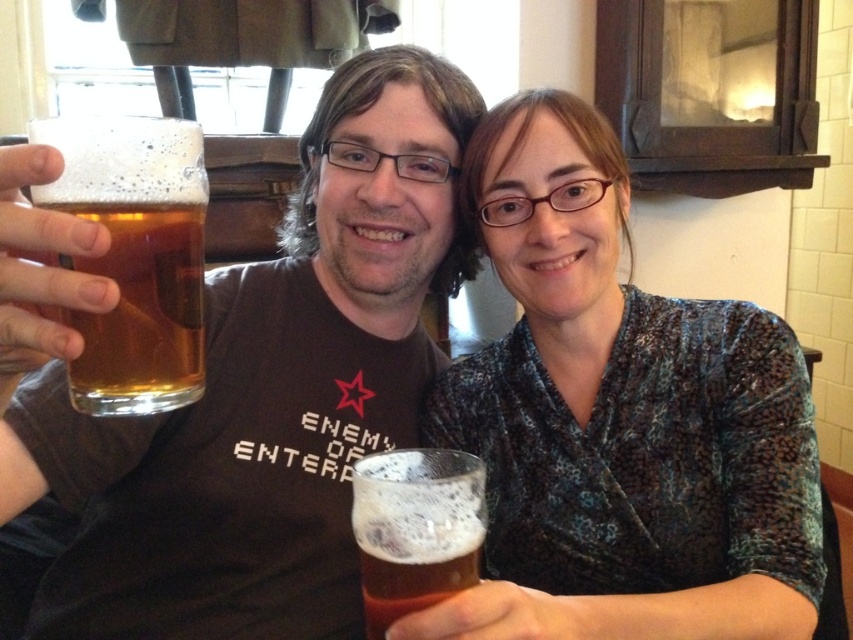
Question: Is translucent glass mug at upper left thinner than golden glass at left?

Choices:
 (A) no
 (B) yes

Answer: (A)

Question: Which point appears farthest from the camera in this image?

Choices:
 (A) (401, 579)
 (B) (773, 458)
 (C) (154, 346)
 (D) (328, 170)

Answer: (D)

Question: Is translucent glass mug at upper left above golden glass at left?

Choices:
 (A) no
 (B) yes

Answer: (A)

Question: Where is translucent glass mug at upper left located in relation to translucent glass at lower center in the image?

Choices:
 (A) above
 (B) below

Answer: (A)

Question: Estimate the real-world distances between objects in this image. Which object is closer to the translucent glass mug at upper left?

Choices:
 (A) golden glass at left
 (B) translucent glass at lower center
 (C) matte brown dress at center

Answer: (C)

Question: Among these objects, which one is farthest from the camera?

Choices:
 (A) translucent glass at lower center
 (B) matte brown dress at center
 (C) golden glass at left

Answer: (B)